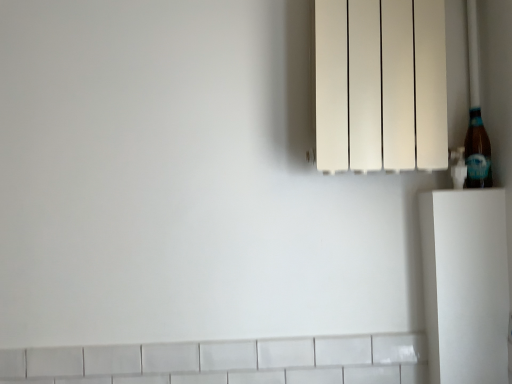
Question: Does brown glass bottle at right come behind white matte radiator at upper right?

Choices:
 (A) no
 (B) yes

Answer: (B)

Question: Is brown glass bottle at right taller than white matte radiator at upper right?

Choices:
 (A) yes
 (B) no

Answer: (B)

Question: Is brown glass bottle at right thinner than white matte radiator at upper right?

Choices:
 (A) yes
 (B) no

Answer: (A)

Question: From the image's perspective, is brown glass bottle at right on white matte radiator at upper right?

Choices:
 (A) no
 (B) yes

Answer: (A)

Question: Is brown glass bottle at right placed right next to white matte radiator at upper right?

Choices:
 (A) no
 (B) yes

Answer: (A)

Question: Is brown glass bottle at right far from white matte radiator at upper right?

Choices:
 (A) no
 (B) yes

Answer: (A)

Question: From a real-world perspective, is white matte radiator at upper right over brown glass bottle at right?

Choices:
 (A) no
 (B) yes

Answer: (B)

Question: Is the position of white matte radiator at upper right more distant than that of brown glass bottle at right?

Choices:
 (A) no
 (B) yes

Answer: (A)

Question: Could brown glass bottle at right be considered to be inside white matte radiator at upper right?

Choices:
 (A) no
 (B) yes

Answer: (B)

Question: From the image's perspective, is white matte radiator at upper right located beneath brown glass bottle at right?

Choices:
 (A) no
 (B) yes

Answer: (A)

Question: Is white matte radiator at upper right facing away from brown glass bottle at right?

Choices:
 (A) no
 (B) yes

Answer: (B)

Question: Is white matte radiator at upper right at the left side of brown glass bottle at right?

Choices:
 (A) yes
 (B) no

Answer: (A)

Question: Is brown glass bottle at right taller or shorter than white matte radiator at upper right?

Choices:
 (A) tall
 (B) short

Answer: (B)